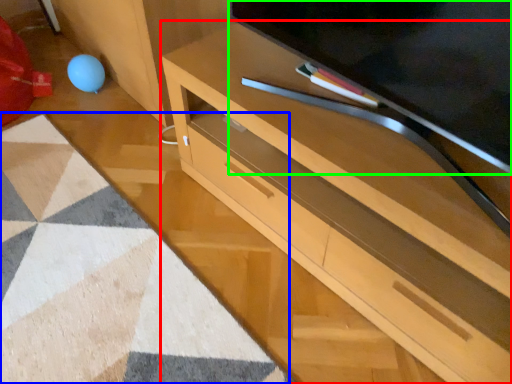
Question: Which object is positioned farthest from desk (highlighted by a red box)? Select from mat (highlighted by a blue box) and television (highlighted by a green box).

Choices:
 (A) mat
 (B) television

Answer: (A)